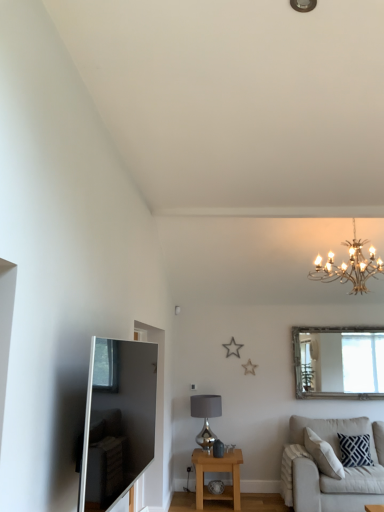
Image resolution: width=384 pixels, height=512 pixels. What do you see at coordinates (117, 420) in the screenshot?
I see `satin silver tv at left` at bounding box center [117, 420].

Find the location of a particular element. silver metallic lampshade at center is located at coordinates (206, 417).

Identify the location of silver-framed mirror at upper right. This screenshot has width=384, height=512. (339, 362).

The image size is (384, 512). In order to click on light oak wooden side table at lower center in this screenshot , I will do `click(217, 471)`.

Considering the positions of objects light oak wooden side table at lower center and silver-framed mirror at upper right in the image provided, who is in front, light oak wooden side table at lower center or silver-framed mirror at upper right?

light oak wooden side table at lower center is more forward.

How much distance is there between light oak wooden side table at lower center and silver-framed mirror at upper right?

light oak wooden side table at lower center and silver-framed mirror at upper right are 6.76 feet apart.

Is silver-framed mirror at upper right inside light oak wooden side table at lower center?

No, silver-framed mirror at upper right is not inside light oak wooden side table at lower center.

From the image's perspective, would you say light oak wooden side table at lower center is shown under silver-framed mirror at upper right?

Yes, from the image's perspective, light oak wooden side table at lower center is below silver-framed mirror at upper right.

Consider the image. Is light oak wooden side table at lower center at the back of silver-framed mirror at upper right?

That's not correct — silver-framed mirror at upper right is not looking away from light oak wooden side table at lower center.

In the image, is silver-framed mirror at upper right positioned in front of or behind light oak wooden side table at lower center?

silver-framed mirror at upper right is behind light oak wooden side table at lower center.

How distant is silver-framed mirror at upper right from light oak wooden side table at lower center?

A distance of 6.76 feet exists between silver-framed mirror at upper right and light oak wooden side table at lower center.

Is the surface of silver-framed mirror at upper right in direct contact with light oak wooden side table at lower center?

They are not placed beside each other.

From the image's perspective, does silver metallic lampshade at center appear higher than navy blue textured pillow at lower right?

Yes, from the image's perspective, silver metallic lampshade at center is over navy blue textured pillow at lower right.

Which is more to the left, silver metallic lampshade at center or navy blue textured pillow at lower right?

silver metallic lampshade at center.

In terms of height, does silver metallic lampshade at center look taller or shorter compared to navy blue textured pillow at lower right?

In the image, silver metallic lampshade at center appears to be taller than navy blue textured pillow at lower right.

Does silver metallic lampshade at center turn towards navy blue textured pillow at lower right?

No, silver metallic lampshade at center does not turn towards navy blue textured pillow at lower right.

You are a GUI agent. You are given a task and a screenshot of the screen. Output one action in this format:
    pyautogui.click(x=<x>, y=<y>)
    Task: Click on the pillow above the light oak wooden side table at lower center (from a real-world perspective)
    The width and height of the screenshot is (384, 512).
    Given the screenshot: What is the action you would take?
    pyautogui.click(x=355, y=450)

Between point (362, 460) and point (205, 462), which one is positioned in front?

The point (205, 462) is more forward.

Considering the relative positions of navy blue textured pillow at lower right and light oak wooden side table at lower center in the image provided, is navy blue textured pillow at lower right to the left or to the right of light oak wooden side table at lower center?

Result: From the image, it's evident that navy blue textured pillow at lower right is to the right of light oak wooden side table at lower center.

Considering the relative positions of silver-framed mirror at upper right and gold metallic chandelier at upper right in the image provided, is silver-framed mirror at upper right to the left or to the right of gold metallic chandelier at upper right?

From the image, it's evident that silver-framed mirror at upper right is to the right of gold metallic chandelier at upper right.

How many degrees apart are the facing directions of silver-framed mirror at upper right and gold metallic chandelier at upper right?

The angular difference between silver-framed mirror at upper right and gold metallic chandelier at upper right is 0.421 degrees.

Measure the distance from silver-framed mirror at upper right to gold metallic chandelier at upper right.

1.36 meters.

Looking at this image, which is in front, silver-framed mirror at upper right or gold metallic chandelier at upper right?

Positioned in front is gold metallic chandelier at upper right.

Considering the positions of point (360, 447) and point (326, 344), is point (360, 447) closer or farther from the camera than point (326, 344)?

Point (360, 447).

Can you confirm if navy blue textured pillow at lower right is positioned to the left of silver-framed mirror at upper right?

Correct, you'll find navy blue textured pillow at lower right to the left of silver-framed mirror at upper right.

Who is more distant, navy blue textured pillow at lower right or silver-framed mirror at upper right?

Positioned behind is silver-framed mirror at upper right.

From the image's perspective, is navy blue textured pillow at lower right on top of silver-framed mirror at upper right?

No.

Which is behind, point (340, 436) or point (371, 429)?

The point (371, 429) is more distant.

Would you consider navy blue textured pillow at lower right to be distant from light beige fabric couch at lower right?

No, navy blue textured pillow at lower right is not far from light beige fabric couch at lower right.

Is navy blue textured pillow at lower right taller or shorter than light beige fabric couch at lower right?

In the image, navy blue textured pillow at lower right appears to be shorter than light beige fabric couch at lower right.

You are a GUI agent. You are given a task and a screenshot of the screen. Output one action in this format:
    pyautogui.click(x=<x>, y=<y>)
    Task: Click on the pillow above the light beige fabric couch at lower right (from the image's perspective)
    This screenshot has height=512, width=384.
    Given the screenshot: What is the action you would take?
    pyautogui.click(x=355, y=450)

This screenshot has width=384, height=512. What are the coordinates of `mirror lying on the right of light oak wooden side table at lower center` in the screenshot? It's located at (339, 362).

The width and height of the screenshot is (384, 512). I want to click on table that is under the silver-framed mirror at upper right (from a real-world perspective), so pyautogui.click(x=217, y=471).

Considering their positions, is silver metallic lampshade at center positioned further to silver-framed mirror at upper right than satin silver tv at left?

Based on the image, satin silver tv at left appears to be further to silver-framed mirror at upper right.

Looking at the image, which one is located further to gold metallic chandelier at upper right, light beige fabric couch at lower right or navy blue textured pillow at lower right?

navy blue textured pillow at lower right is positioned further to the anchor gold metallic chandelier at upper right.

Looking at the image, which one is located further to silver metallic lampshade at center, satin silver tv at left or light oak wooden side table at lower center?

satin silver tv at left.

Based on their spatial positions, is light oak wooden side table at lower center or satin silver tv at left further from light beige fabric couch at lower right?

satin silver tv at left is positioned further to the anchor light beige fabric couch at lower right.

Estimate the real-world distances between objects in this image. Which object is further from silver-framed mirror at upper right, light oak wooden side table at lower center or light beige fabric couch at lower right?

Among the two, light oak wooden side table at lower center is located further to silver-framed mirror at upper right.

Based on their spatial positions, is light beige fabric couch at lower right or satin silver tv at left further from light oak wooden side table at lower center?

Among the two, satin silver tv at left is located further to light oak wooden side table at lower center.

Considering their positions, is satin silver tv at left positioned closer to gold metallic chandelier at upper right than light beige fabric couch at lower right?

The object closer to gold metallic chandelier at upper right is light beige fabric couch at lower right.

From the image, which object appears to be farther from navy blue textured pillow at lower right, light oak wooden side table at lower center or silver-framed mirror at upper right?

Among the two, light oak wooden side table at lower center is located further to navy blue textured pillow at lower right.

Image resolution: width=384 pixels, height=512 pixels. Find the location of `table located between satin silver tv at left and silver metallic lampshade at center in the depth direction`. table located between satin silver tv at left and silver metallic lampshade at center in the depth direction is located at coordinates (217, 471).

Where is `lamp between gold metallic chandelier at upper right and light beige fabric couch at lower right in the up-down direction`? Image resolution: width=384 pixels, height=512 pixels. lamp between gold metallic chandelier at upper right and light beige fabric couch at lower right in the up-down direction is located at coordinates (206, 417).

You are a GUI agent. You are given a task and a screenshot of the screen. Output one action in this format:
    pyautogui.click(x=<x>, y=<y>)
    Task: Click on the pillow between gold metallic chandelier at upper right and light oak wooden side table at lower center from top to bottom
    This screenshot has width=384, height=512.
    Given the screenshot: What is the action you would take?
    pyautogui.click(x=355, y=450)

Where is `lamp located between satin silver tv at left and silver-framed mirror at upper right in the depth direction`? The width and height of the screenshot is (384, 512). lamp located between satin silver tv at left and silver-framed mirror at upper right in the depth direction is located at coordinates (206, 417).